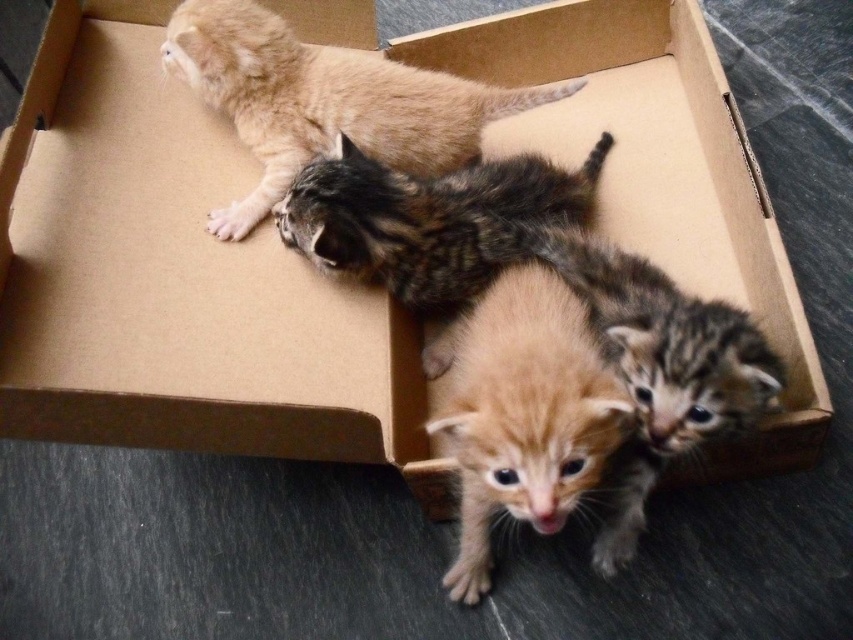
Between golden fur kitten at upper left and tabby fur cat at center, which one is positioned higher?

golden fur kitten at upper left

The width and height of the screenshot is (853, 640). What are the coordinates of `golden fur kitten at upper left` in the screenshot? It's located at (325, 100).

Which is behind, point (467, 116) or point (390, 221)?

Positioned behind is point (467, 116).

Image resolution: width=853 pixels, height=640 pixels. What are the coordinates of `golden fur kitten at upper left` in the screenshot? It's located at (325, 100).

Does fluffy orange kitten at center lie in front of golden fur kitten at upper left?

Yes, it is in front of golden fur kitten at upper left.

Locate an element on the screen. fluffy orange kitten at center is located at coordinates (520, 412).

Who is more distant from viewer, (x=450, y=452) or (x=192, y=10)?

Positioned behind is point (x=192, y=10).

Where is `fluffy orange kitten at center`? This screenshot has width=853, height=640. fluffy orange kitten at center is located at coordinates (520, 412).

Which is in front, point (576, 387) or point (492, 227)?

Point (576, 387) is in front.

In the scene shown: Does fluffy orange kitten at center appear on the left side of tabby fur cat at center?

In fact, fluffy orange kitten at center is to the right of tabby fur cat at center.

Between point (555, 317) and point (460, 221), which one is positioned behind?

Point (460, 221)

At what (x,y) coordinates should I click in order to perform the action: click on fluffy orange kitten at center. Please return your answer as a coordinate pair (x, y). Image resolution: width=853 pixels, height=640 pixels. Looking at the image, I should click on (520, 412).